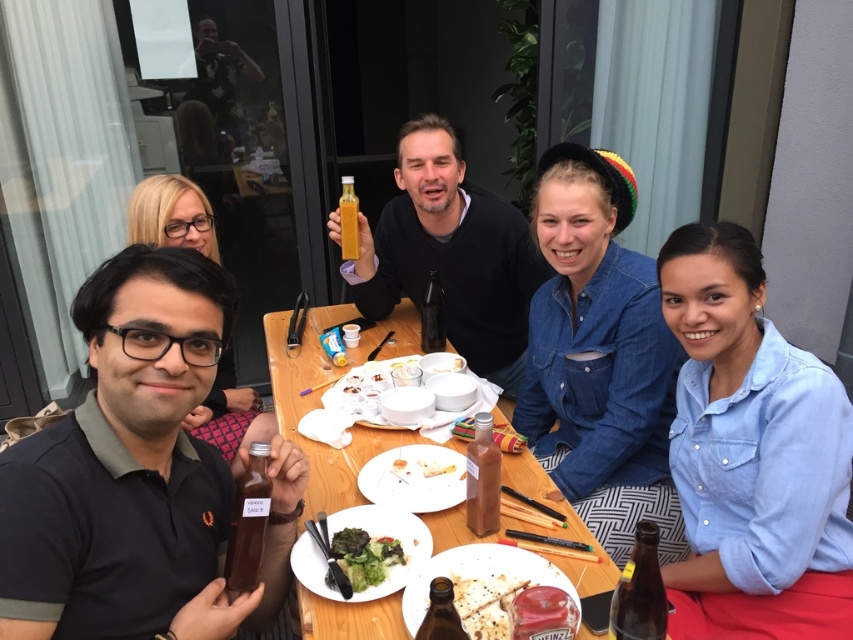
Looking at this image, which of these two, wooden table at center or brown crispy bread at lower center, stands shorter?

brown crispy bread at lower center

Can you confirm if wooden table at center is taller than brown crispy bread at lower center?

Yes.

Does point (457, 525) come farther from viewer compared to point (514, 592)?

Yes, point (457, 525) is behind point (514, 592).

In order to click on wooden table at center in this screenshot , I will do `click(329, 387)`.

Who is positioned more to the right, brown matte bottle at lower left or green leafy salad at center?

From the viewer's perspective, green leafy salad at center appears more on the right side.

Looking at this image, who is lower down, brown matte bottle at lower left or green leafy salad at center?

green leafy salad at center is lower down.

Where is `brown matte bottle at lower left`? This screenshot has width=853, height=640. brown matte bottle at lower left is located at coordinates (138, 474).

Find the location of a particular element. brown matte bottle at lower left is located at coordinates pyautogui.click(x=138, y=474).

Who is more distant from viewer, (x=706, y=243) or (x=350, y=280)?

The point (x=350, y=280) is more distant.

Is blue denim shirt at center positioned behind matte black sweater at center?

No, it is in front of matte black sweater at center.

Locate an element on the screen. This screenshot has width=853, height=640. blue denim shirt at center is located at coordinates (751, 456).

Locate an element on the screen. The image size is (853, 640). blue denim shirt at center is located at coordinates (751, 456).